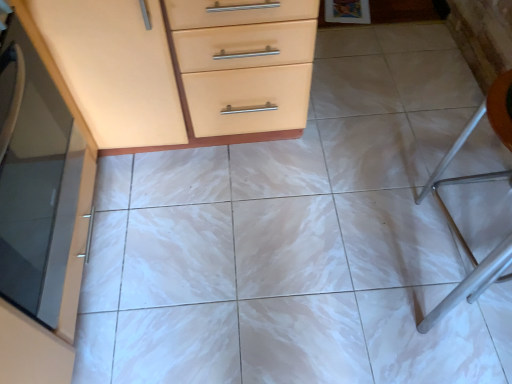
Question: From the image's perspective, does orange plastic folding chair at right appear higher than matte glass cabinet at left?

Choices:
 (A) yes
 (B) no

Answer: (A)

Question: Is orange plastic folding chair at right looking in the opposite direction of matte glass cabinet at left?

Choices:
 (A) yes
 (B) no

Answer: (B)

Question: Does orange plastic folding chair at right have a greater width compared to matte glass cabinet at left?

Choices:
 (A) no
 (B) yes

Answer: (B)

Question: Is orange plastic folding chair at right taller than matte glass cabinet at left?

Choices:
 (A) yes
 (B) no

Answer: (A)

Question: From the image's perspective, would you say orange plastic folding chair at right is shown under matte glass cabinet at left?

Choices:
 (A) yes
 (B) no

Answer: (B)

Question: From their relative heights in the image, would you say matte wood chest of drawers at upper left, placed as the 2th chest of drawers when sorted from top to bottom, is taller or shorter than matte orange cabinet at upper left, placed as the 1th chest of drawers when sorted from top to bottom?

Choices:
 (A) tall
 (B) short

Answer: (A)

Question: Visually, is matte wood chest of drawers at upper left, placed as the 2th chest of drawers when sorted from top to bottom, positioned to the left or to the right of matte orange cabinet at upper left, placed as the second chest of drawers when sorted from bottom to top?

Choices:
 (A) right
 (B) left

Answer: (A)

Question: From the image's perspective, is matte wood chest of drawers at upper left, marked as the 1th chest of drawers in a bottom-to-top arrangement, positioned above or below matte orange cabinet at upper left, placed as the 1th chest of drawers when sorted from top to bottom?

Choices:
 (A) below
 (B) above

Answer: (A)

Question: Considering their positions, is matte wood chest of drawers at upper left, marked as the 1th chest of drawers in a bottom-to-top arrangement, located in front of or behind matte orange cabinet at upper left, placed as the second chest of drawers when sorted from bottom to top?

Choices:
 (A) front
 (B) behind

Answer: (A)

Question: In terms of size, does orange plastic folding chair at right appear bigger or smaller than matte orange cabinet at upper left, placed as the 1th chest of drawers when sorted from top to bottom?

Choices:
 (A) small
 (B) big

Answer: (A)

Question: Would you say orange plastic folding chair at right is to the left or to the right of matte orange cabinet at upper left, placed as the 1th chest of drawers when sorted from top to bottom, in the picture?

Choices:
 (A) left
 (B) right

Answer: (B)

Question: Does point (479, 291) appear closer or farther from the camera than point (296, 3)?

Choices:
 (A) farther
 (B) closer

Answer: (A)

Question: Is orange plastic folding chair at right inside or outside of matte orange cabinet at upper left, placed as the second chest of drawers when sorted from bottom to top?

Choices:
 (A) outside
 (B) inside

Answer: (A)

Question: Which is correct: matte wood chest of drawers at upper left, placed as the 2th chest of drawers when sorted from top to bottom, is inside orange plastic folding chair at right, or outside of it?

Choices:
 (A) outside
 (B) inside

Answer: (A)

Question: Does point (258, 6) appear closer or farther from the camera than point (490, 273)?

Choices:
 (A) closer
 (B) farther

Answer: (A)